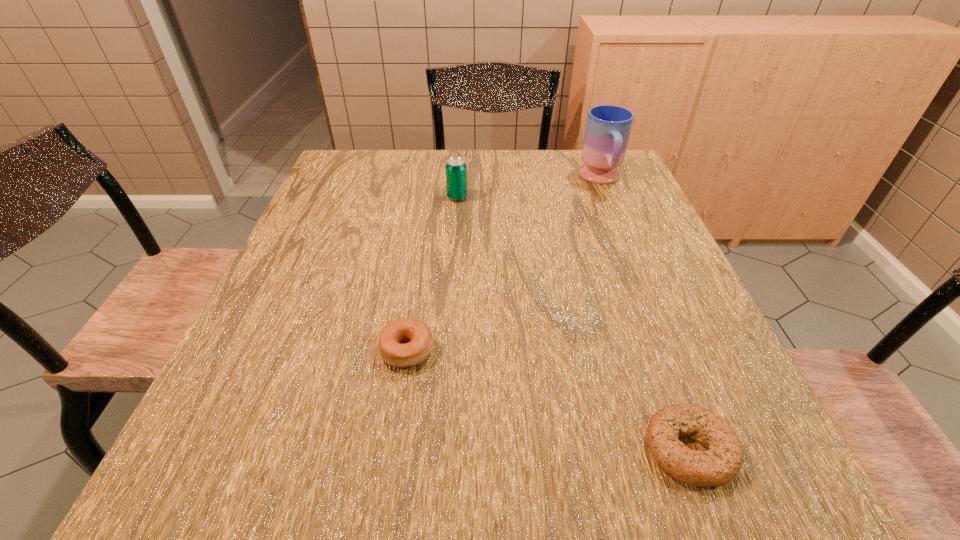
Find the location of a particular element. empty space that is in between the right bagel and the mug is located at coordinates (645, 314).

Where is `object that stands as the third closest to the left bagel`? object that stands as the third closest to the left bagel is located at coordinates (608, 127).

Choose which object is the second nearest neighbor to the farther bagel. Please provide its 2D coordinates. Your answer should be formatted as a tuple, i.e. [(x, y)], where the tuple contains the x and y coordinates of a point satisfying the conditions above.

[(456, 169)]

Where is `vacant region that satisfies the following two spatial constraints: 1. on the front side of the nearer bagel; 2. on the left side of the left bagel`? vacant region that satisfies the following two spatial constraints: 1. on the front side of the nearer bagel; 2. on the left side of the left bagel is located at coordinates (392, 449).